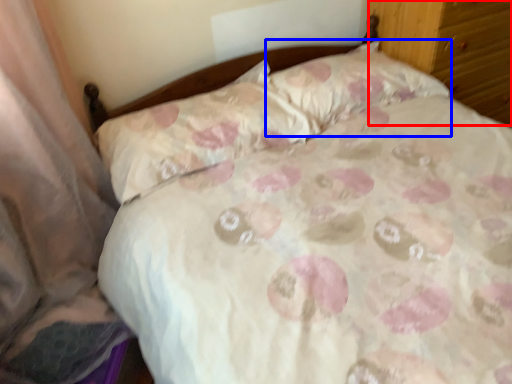
Question: Which object appears farthest to the camera in this image, dresser (highlighted by a red box) or pillow (highlighted by a blue box)?

Choices:
 (A) dresser
 (B) pillow

Answer: (A)